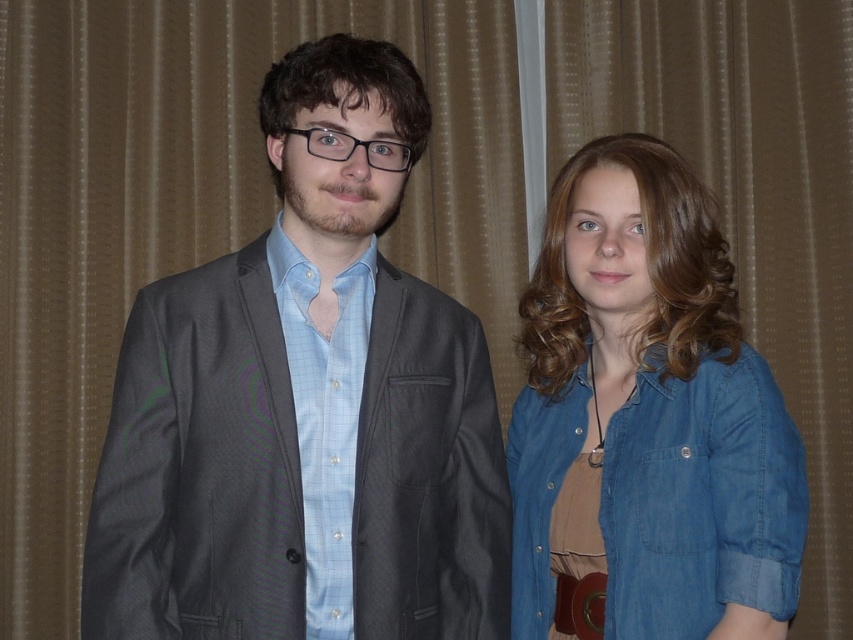
Looking at this image, does matte gray blazer at center have a lesser width compared to denim shirt at right?

No, matte gray blazer at center is not thinner than denim shirt at right.

Does point (279, 536) lie behind point (521, 618)?

No, (279, 536) is closer to viewer.

Image resolution: width=853 pixels, height=640 pixels. What are the coordinates of `matte gray blazer at center` in the screenshot? It's located at (306, 406).

In order to click on matte gray blazer at center in this screenshot , I will do `click(306, 406)`.

Is denim shirt at right closer to the viewer compared to brown leather belt at lower center?

That is True.

Is denim shirt at right below brown leather belt at lower center?

No, denim shirt at right is not below brown leather belt at lower center.

Between point (641, 557) and point (560, 580), which one is positioned in front?

Point (641, 557)

Identify the location of denim shirt at right. Image resolution: width=853 pixels, height=640 pixels. (648, 416).

Between matte gray blazer at center and brown leather belt at lower center, which one has less height?

brown leather belt at lower center

Locate an element on the screen. matte gray blazer at center is located at coordinates (306, 406).

The image size is (853, 640). Find the location of `matte gray blazer at center`. matte gray blazer at center is located at coordinates (306, 406).